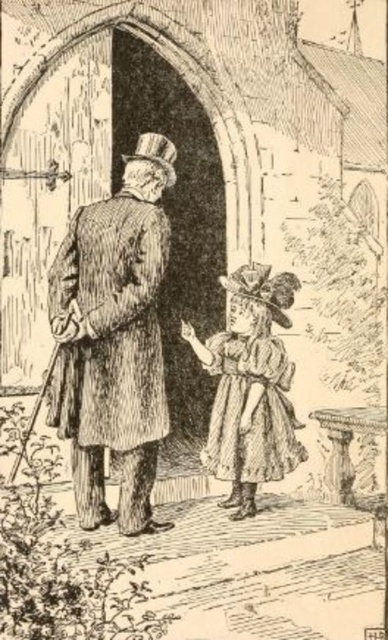
Is brown textured coat at center behind matte brown dress at center?

No, brown textured coat at center is in front of matte brown dress at center.

Is point (138, 291) more distant than point (242, 314)?

No, it is in front of (242, 314).

I want to click on brown textured coat at center, so click(114, 337).